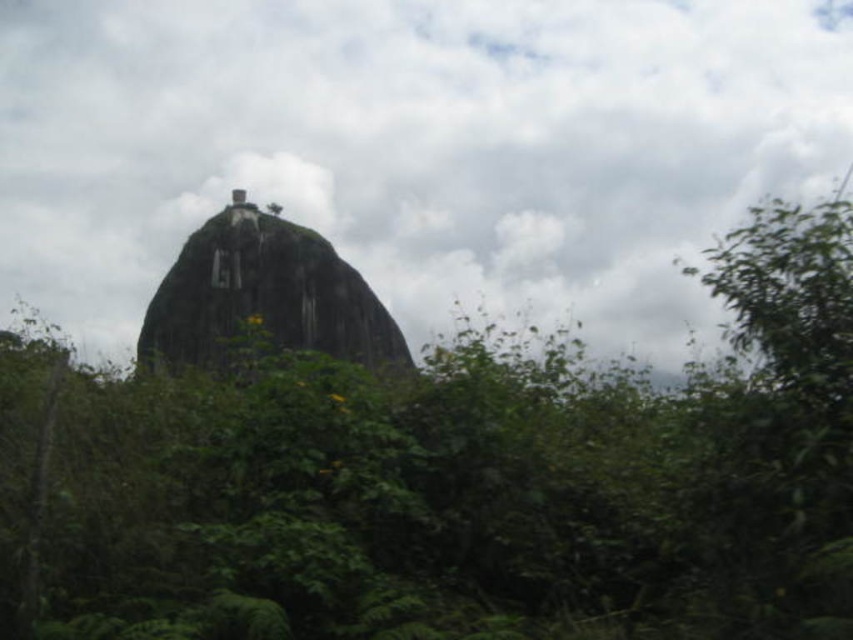
Based on the photo, can you confirm if green leafy tree at center is positioned to the right of white fluffy cloud at upper center?

Yes, green leafy tree at center is to the right of white fluffy cloud at upper center.

Between green leafy tree at center and white fluffy cloud at upper center, which one is positioned lower?

green leafy tree at center is lower down.

Identify the location of green leafy tree at center. (438, 468).

Locate an element on the screen. The height and width of the screenshot is (640, 853). green leafy tree at center is located at coordinates (438, 468).

At what (x,y) coordinates should I click in order to perform the action: click on green leafy tree at center. Please return your answer as a coordinate pair (x, y). Looking at the image, I should click on (438, 468).

Between green leafy tree at center and green rough rock at center, which one has less height?

green rough rock at center is shorter.

Between point (517, 488) and point (222, 346), which one is positioned behind?

Positioned behind is point (222, 346).

Where is `green leafy tree at center`? Image resolution: width=853 pixels, height=640 pixels. green leafy tree at center is located at coordinates (438, 468).

Which is in front, point (352, 216) or point (190, 252)?

Point (190, 252)

Does point (374, 218) come closer to viewer compared to point (212, 275)?

No, it is behind (212, 275).

Where is `white fluffy cloud at upper center`? The height and width of the screenshot is (640, 853). white fluffy cloud at upper center is located at coordinates (415, 147).